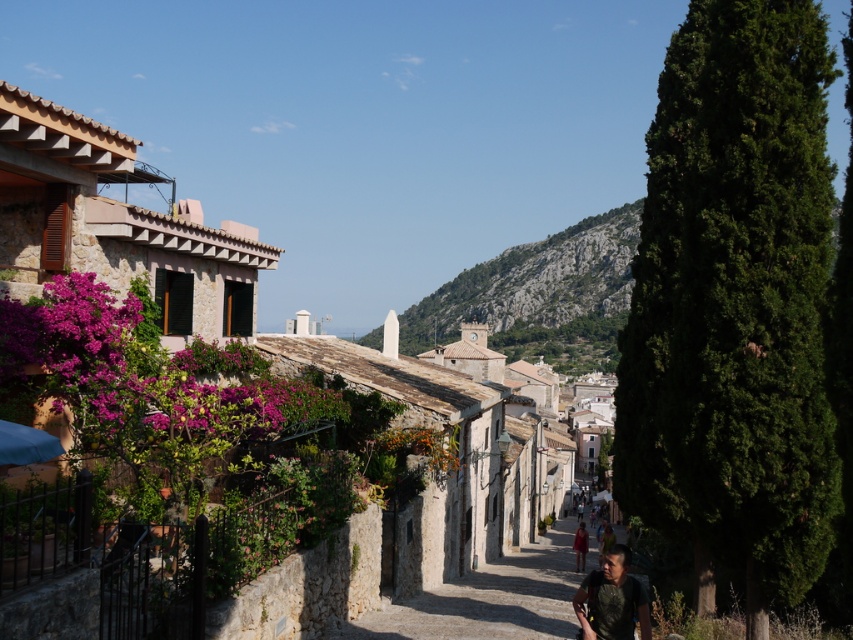
You are a tourist standing on the street looking at the green leafy cypress at right and the stone village at center. Which object is higher in the image?

The green leafy cypress at right is located above the stone village at center, so it is higher in the image.

You are a photographer planning to capture the entire scene of the stone village at center and the green leafy cypress at right in a single shot. Based on their sizes, which object should you position closer to the edge of the frame to ensure both are fully visible?

The green leafy cypress at right is narrower than the stone village at center, so positioning the cypress closer to the edge of the frame would allow both to fit within the shot since it requires less space.

You are standing at the camera position looking at the street scene. There is a point marked at coordinates point (x=714, y=234). If you want to throw a small ball to hit that point, and the maximum distance you can throw is 70 feet, will you be able to reach it?

The distance of point (x=714, y=234) from camera is 68.60 feet, which is within your throwing range of 70 feet. Therefore, you can reach it.